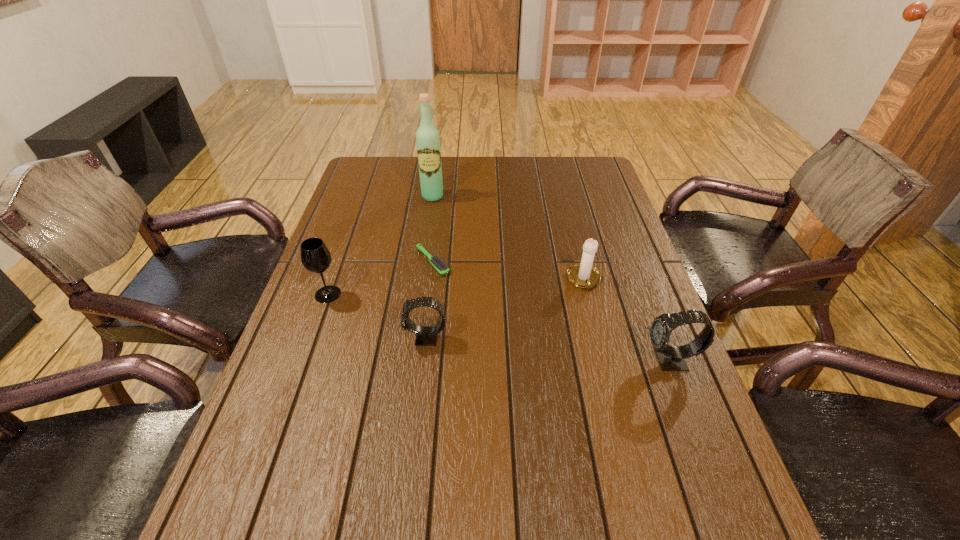
You are a GUI agent. You are given a task and a screenshot of the screen. Output one action in this format:
    pyautogui.click(x=<x>, y=<y>)
    Task: Click on the vacant region between the hairbrush and the leftmost object
    
    Given the screenshot: What is the action you would take?
    pyautogui.click(x=380, y=278)

Where is `empty space between the shorter watch and the leftmost object`? The height and width of the screenshot is (540, 960). empty space between the shorter watch and the leftmost object is located at coordinates (377, 316).

Where is `free space between the wine bottle and the rightmost object`? The height and width of the screenshot is (540, 960). free space between the wine bottle and the rightmost object is located at coordinates (552, 279).

Where is `vacant region between the wineglass and the right watch`? The width and height of the screenshot is (960, 540). vacant region between the wineglass and the right watch is located at coordinates 499,328.

The height and width of the screenshot is (540, 960). Find the location of `empty location between the left watch and the tallest object`. empty location between the left watch and the tallest object is located at coordinates (429, 267).

Where is `empty space between the hairbrush and the leftmost object`? The height and width of the screenshot is (540, 960). empty space between the hairbrush and the leftmost object is located at coordinates (380, 278).

Where is `vacant space that's between the shorter watch and the taller watch`? vacant space that's between the shorter watch and the taller watch is located at coordinates (548, 349).

The image size is (960, 540). In order to click on empty space between the tallest object and the rightmost object in this screenshot , I will do `click(552, 279)`.

Identify which object is located as the third nearest to the taller watch. Please provide its 2D coordinates. Your answer should be formatted as a tuple, i.e. [(x, y)], where the tuple contains the x and y coordinates of a point satisfying the conditions above.

[(436, 261)]

What are the coordinates of `object that is the second nearest to the left watch` in the screenshot? It's located at (315, 256).